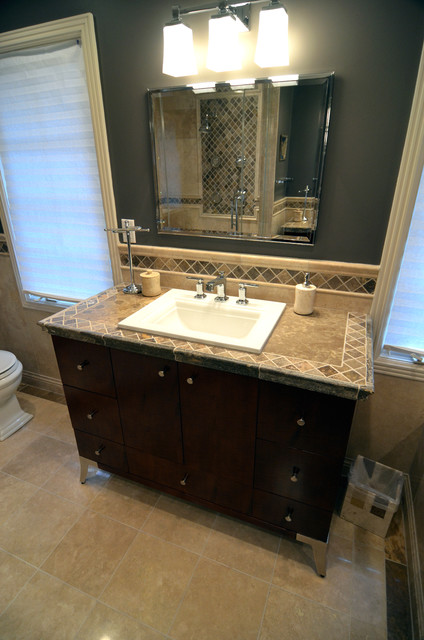
Locate an element on the screen. The width and height of the screenshot is (424, 640). lights is located at coordinates (177, 58), (216, 45), (278, 43).